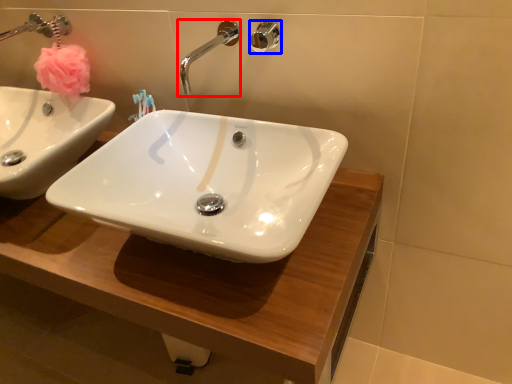
Question: Which point is closer to the camera, tap (highlighted by a red box) or shower (highlighted by a blue box)?

Choices:
 (A) tap
 (B) shower

Answer: (A)